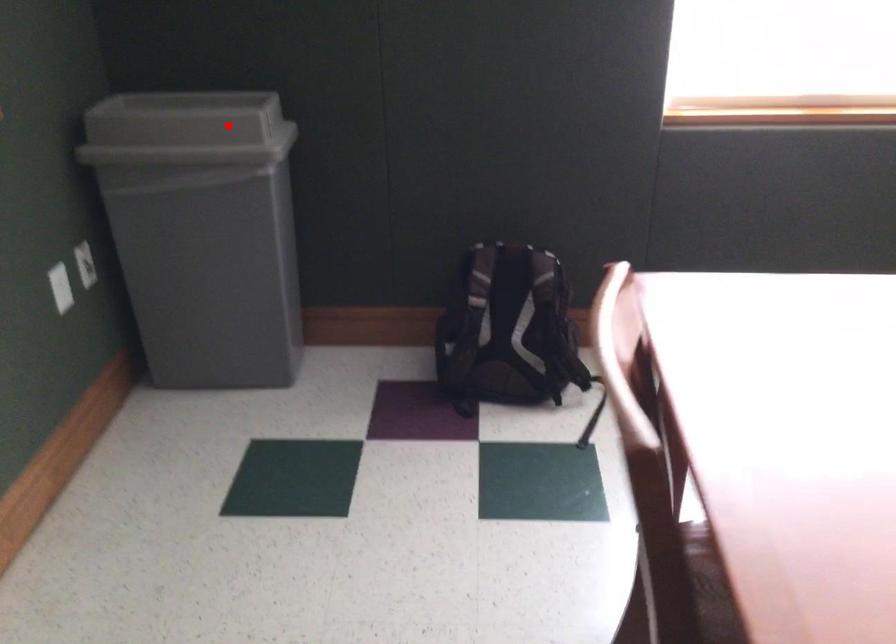
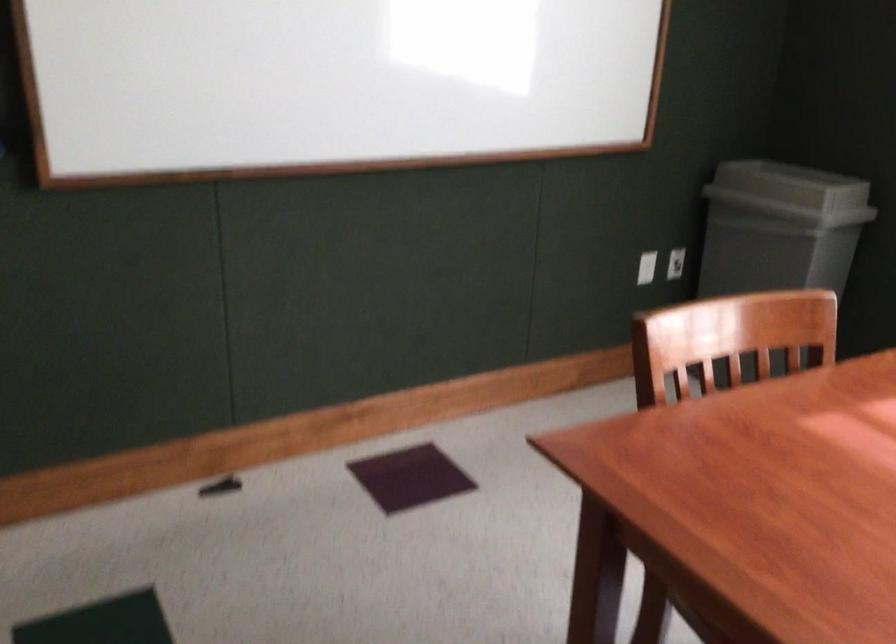
Question: I am providing you with two images of the same scene from different viewpoints. Image1 has a red point marked. In image2, the corresponding 3D location appears at what relative position? Reply with the corresponding letter.

Choices:
 (A) Closer
 (B) Farther

Answer: (B)